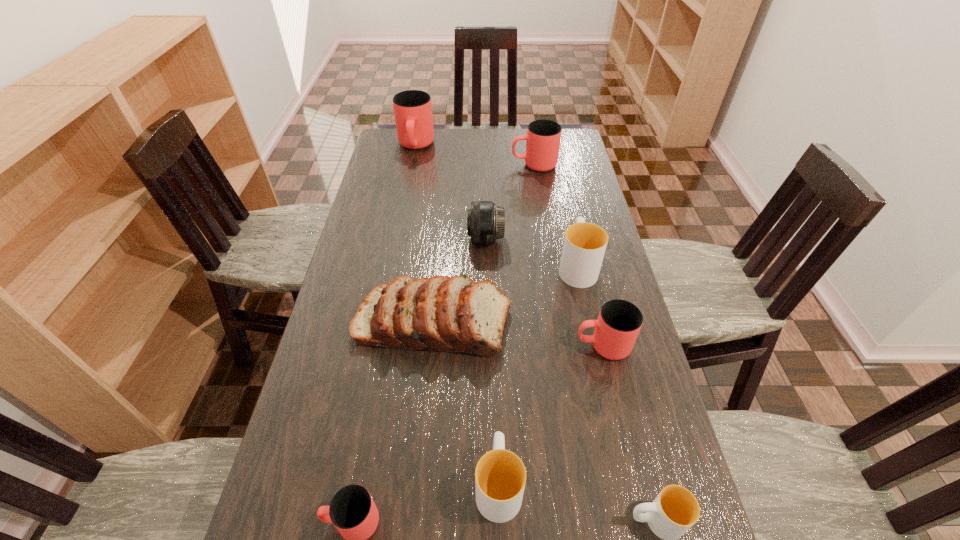
Locate an element on the screen. the tallest cup is located at coordinates (413, 110).

You are a GUI agent. You are given a task and a screenshot of the screen. Output one action in this format:
    pyautogui.click(x=<x>, y=<y>)
    Task: Click on the biggest pink cup
    The width and height of the screenshot is (960, 540).
    Given the screenshot: What is the action you would take?
    pyautogui.click(x=413, y=110)

At what (x,y) coordinates should I click in order to perform the action: click on the third smallest pink cup. Please return your answer as a coordinate pair (x, y). The height and width of the screenshot is (540, 960). Looking at the image, I should click on (543, 136).

Find the location of a particular element. The height and width of the screenshot is (540, 960). the farthest yellow cup is located at coordinates (585, 243).

This screenshot has height=540, width=960. Find the location of `the third farthest cup`. the third farthest cup is located at coordinates (585, 243).

Find the location of a particular element. The height and width of the screenshot is (540, 960). telephoto lens is located at coordinates (486, 222).

Locate an element on the screen. This screenshot has height=540, width=960. bread is located at coordinates (453, 314).

Where is `the second nearest pink cup`? This screenshot has width=960, height=540. the second nearest pink cup is located at coordinates (616, 329).

The height and width of the screenshot is (540, 960). I want to click on the fourth farthest cup, so click(x=616, y=329).

Identify the location of the leftmost yellow cup. (500, 476).